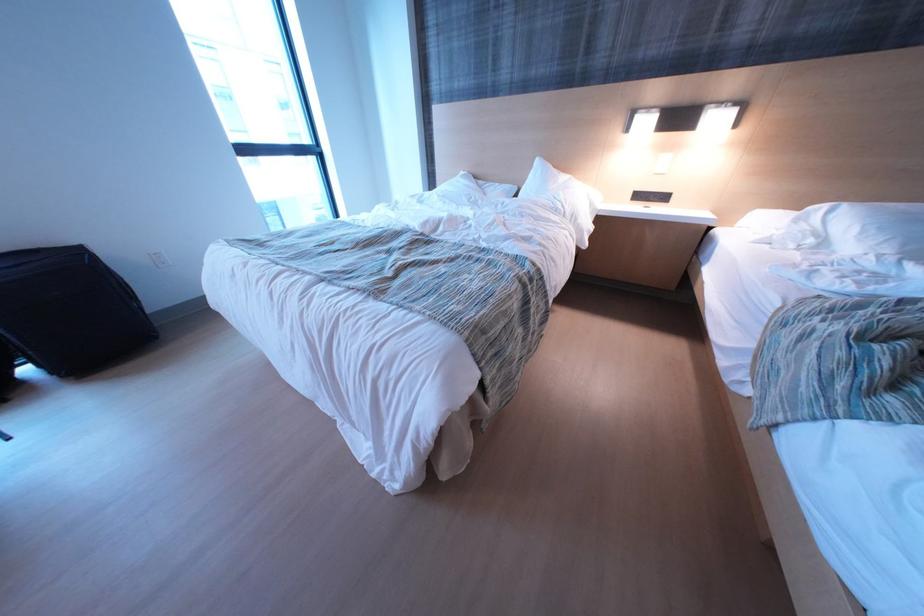
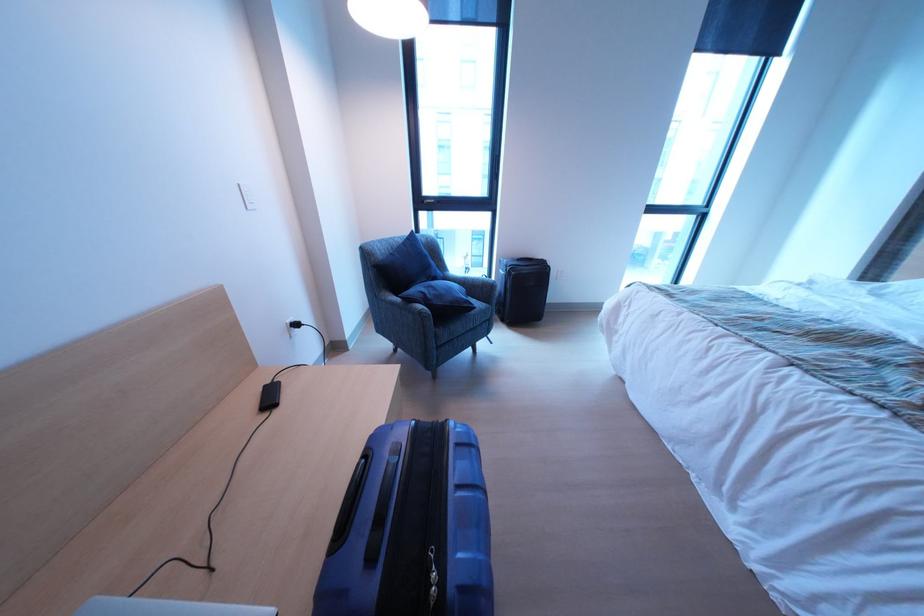
Question: Based on the continuous images, in which direction is the camera rotating? Reply with the corresponding letter.

Choices:
 (A) Left
 (B) Right
 (C) Up
 (D) Down

Answer: (A)